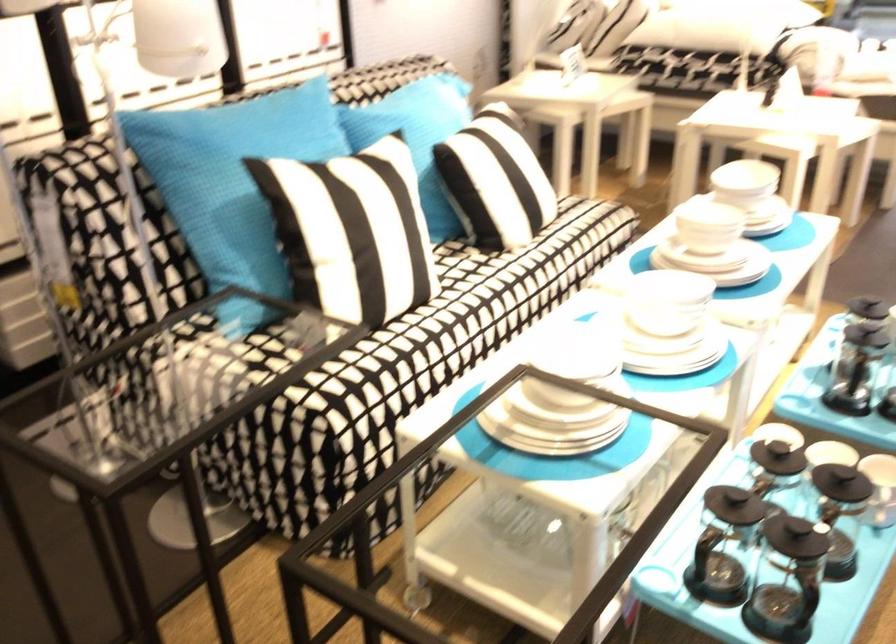
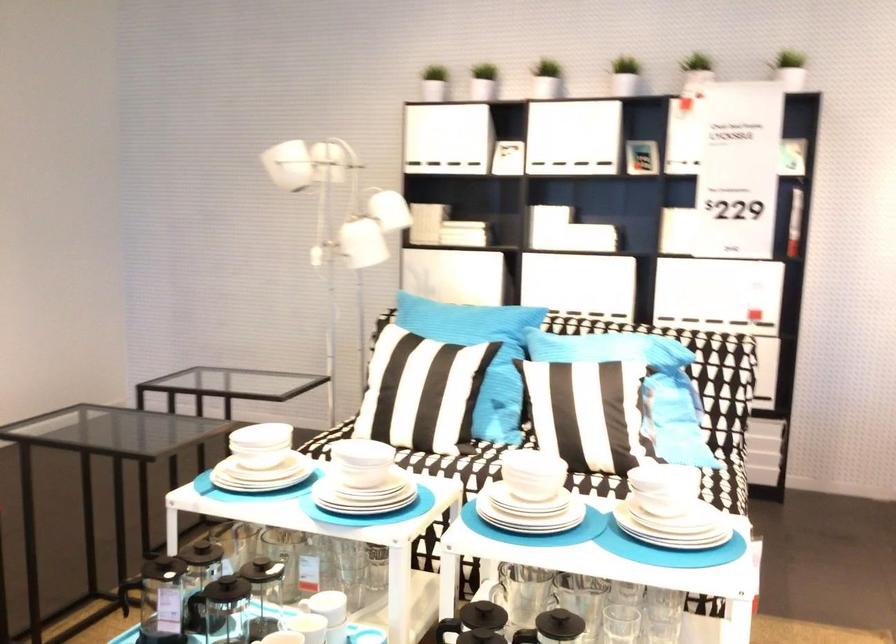
Locate, in the second image, the point that corresponds to point 733,513 in the first image.

(201, 552)